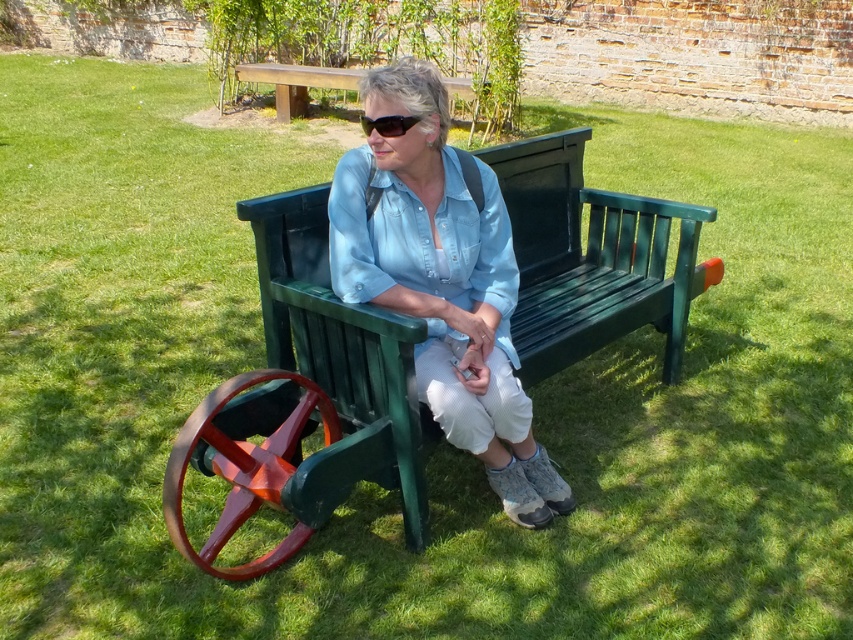
Is point (300, 307) positioned after point (495, 356)?

No, it is in front of (495, 356).

I want to click on green painted wood park bench at center, so click(590, 257).

I want to click on green painted wood park bench at center, so click(x=590, y=257).

How distant is matte green bench at center from black plastic sunglasses at center?

A distance of 20.73 inches exists between matte green bench at center and black plastic sunglasses at center.

Where is `matte green bench at center`? This screenshot has width=853, height=640. matte green bench at center is located at coordinates (442, 280).

Locate an element on the screen. The height and width of the screenshot is (640, 853). matte green bench at center is located at coordinates (442, 280).

Between point (521, 186) and point (379, 124), which one is positioned in front?

Point (379, 124) is more forward.

Describe the element at coordinates (590, 257) in the screenshot. The width and height of the screenshot is (853, 640). I see `green painted wood park bench at center` at that location.

At what (x,y) coordinates should I click in order to perform the action: click on green painted wood park bench at center. Please return your answer as a coordinate pair (x, y). Image resolution: width=853 pixels, height=640 pixels. Looking at the image, I should click on (590, 257).